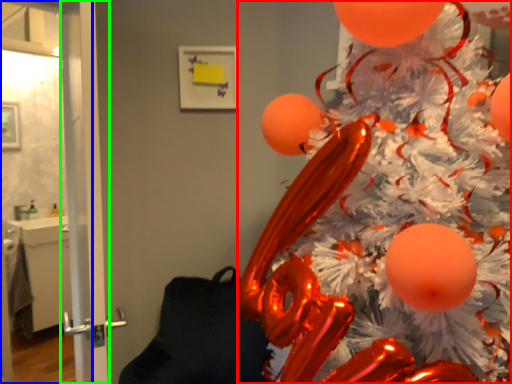
Question: Which object is the closest to the christmas tree (highlighted by a red box)? Choose among these: screen door (highlighted by a blue box) or screen door (highlighted by a green box).

Choices:
 (A) screen door
 (B) screen door

Answer: (A)